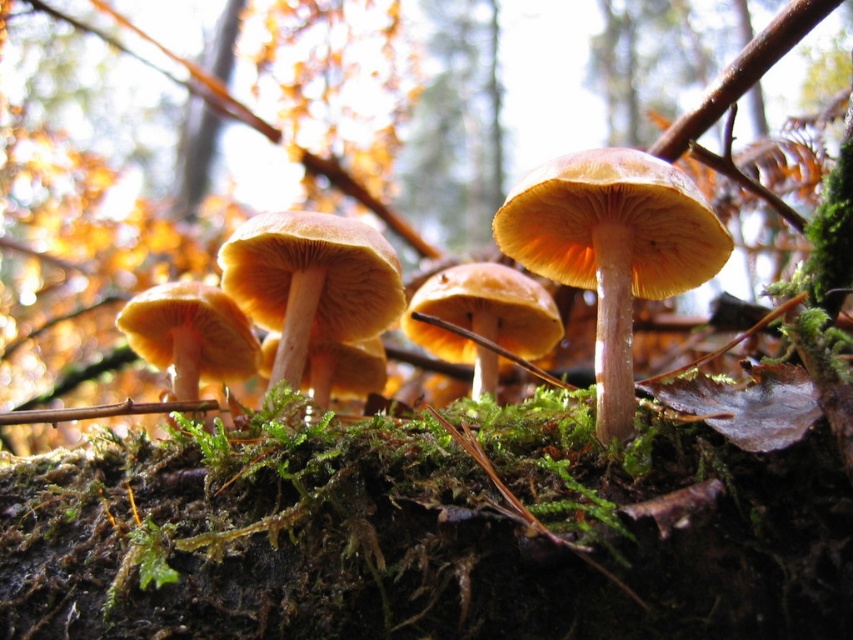
You are a mycologist examining a closeup of several mushrooms on a mossy surface. You notice a shiny orange mushroom at center. Based on its coordinates, can you determine its exact location in the image?

The shiny orange mushroom at center is located at coordinates point (612, 250).

You are a forager looking for mushrooms in the forest. You spot two mushrooms in the center of your view. Which one is positioned higher up between the shiny orange mushroom at center and the light brown smooth mushroom at center?

The shiny orange mushroom at center is positioned higher up than the light brown smooth mushroom at center.